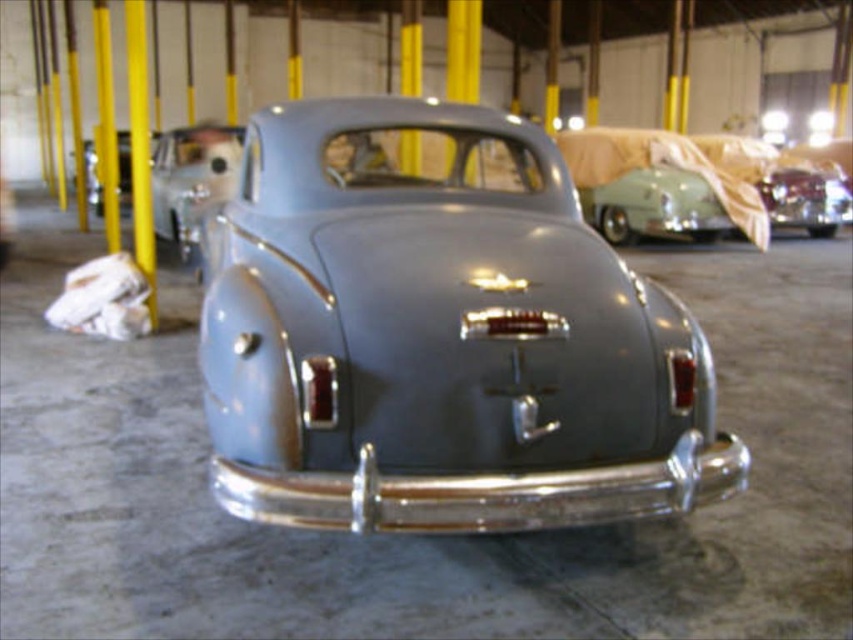
Question: Which point is closer to the camera taking this photo?

Choices:
 (A) (396, 298)
 (B) (169, 202)

Answer: (A)

Question: Is satin gray car at center smaller than matte gray car at center?

Choices:
 (A) yes
 (B) no

Answer: (B)

Question: Is satin gray car at center bigger than matte gray car at center?

Choices:
 (A) yes
 (B) no

Answer: (A)

Question: Can you confirm if satin gray car at center is positioned to the right of matte gray car at center?

Choices:
 (A) yes
 (B) no

Answer: (A)